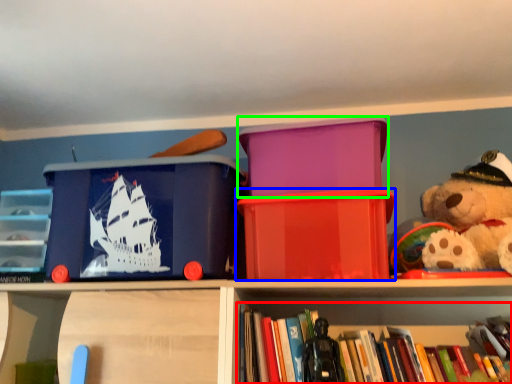
Question: Considering the real-world distances, which object is farthest from book (highlighted by a red box)? storage box (highlighted by a blue box) or storage box (highlighted by a green box)?

Choices:
 (A) storage box
 (B) storage box

Answer: (B)